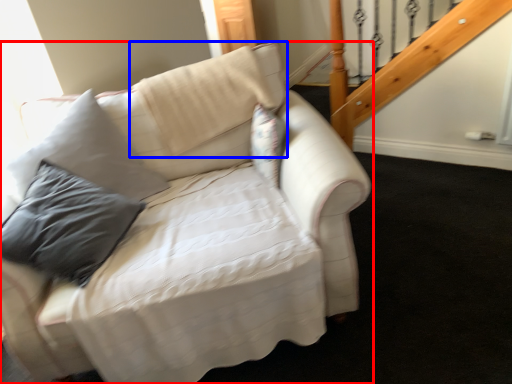
Question: Which object is further to the camera taking this photo, studio couch (highlighted by a red box) or pillow (highlighted by a blue box)?

Choices:
 (A) studio couch
 (B) pillow

Answer: (B)